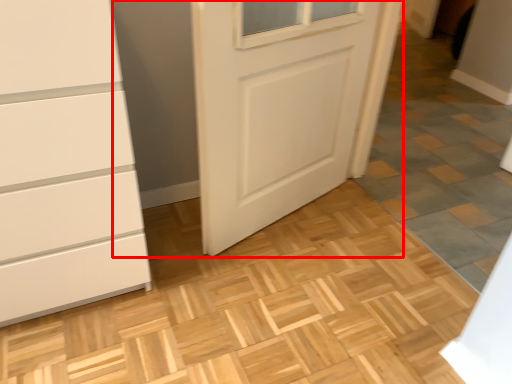
Question: From the image's perspective, where is door (annotated by the red box) located relative to tile?

Choices:
 (A) above
 (B) below

Answer: (A)